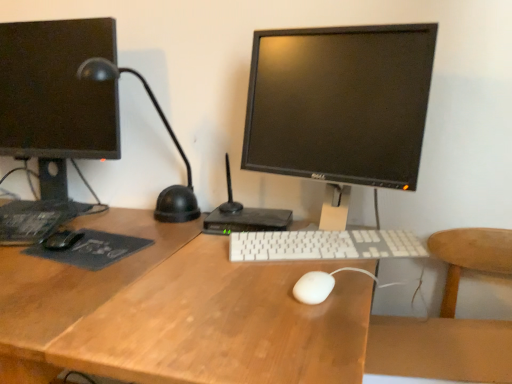
Find the location of a particular element. The image size is (512, 384). free space behind dark gray matte mousepad at left is located at coordinates (119, 219).